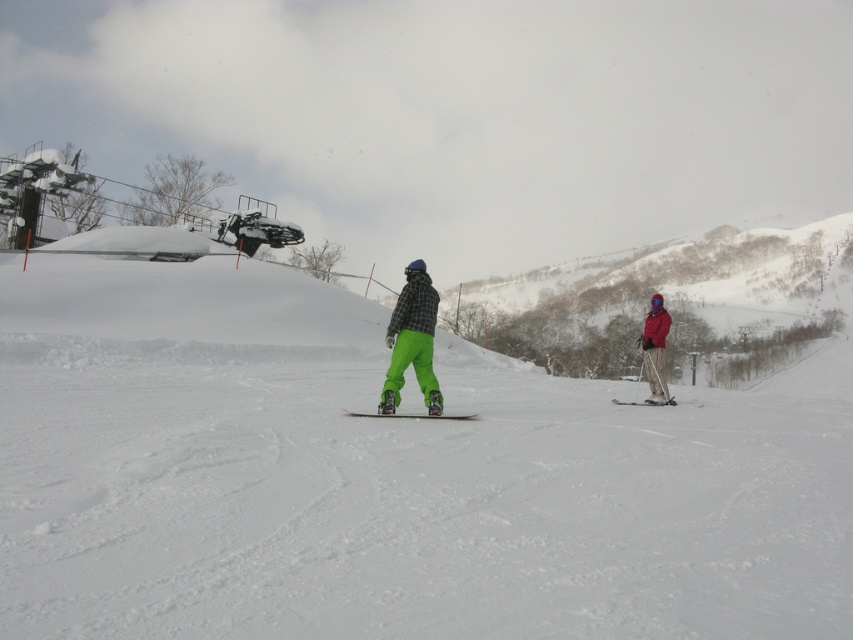
Does neon green snowboard at center lie in front of green matte snowboard at center?

No, it is behind green matte snowboard at center.

Is neon green snowboard at center thinner than green matte snowboard at center?

No, neon green snowboard at center is not thinner than green matte snowboard at center.

Does point (381, 392) come in front of point (448, 416)?

Yes, it is in front of point (448, 416).

The image size is (853, 640). I want to click on neon green snowboard at center, so click(410, 342).

You are a GUI agent. You are given a task and a screenshot of the screen. Output one action in this format:
    pyautogui.click(x=<x>, y=<y>)
    Task: Click on the white fluffy snow at center
    
    Given the screenshot: What is the action you would take?
    pyautogui.click(x=386, y=476)

Can you confirm if white fluffy snow at center is taller than matte black snowboard at center?

Indeed, white fluffy snow at center has a greater height compared to matte black snowboard at center.

This screenshot has width=853, height=640. Describe the element at coordinates (386, 476) in the screenshot. I see `white fluffy snow at center` at that location.

Identify the location of white fluffy snow at center. coord(386,476).

Can you confirm if neon green snowboard at center is bigger than matte black snowboard at center?

Yes, neon green snowboard at center is bigger than matte black snowboard at center.

Between neon green snowboard at center and matte black snowboard at center, which one appears on the right side from the viewer's perspective?

Positioned to the right is matte black snowboard at center.

Is point (384, 385) more distant than point (618, 401)?

No, it is not.

Locate an element on the screen. neon green snowboard at center is located at coordinates (410, 342).